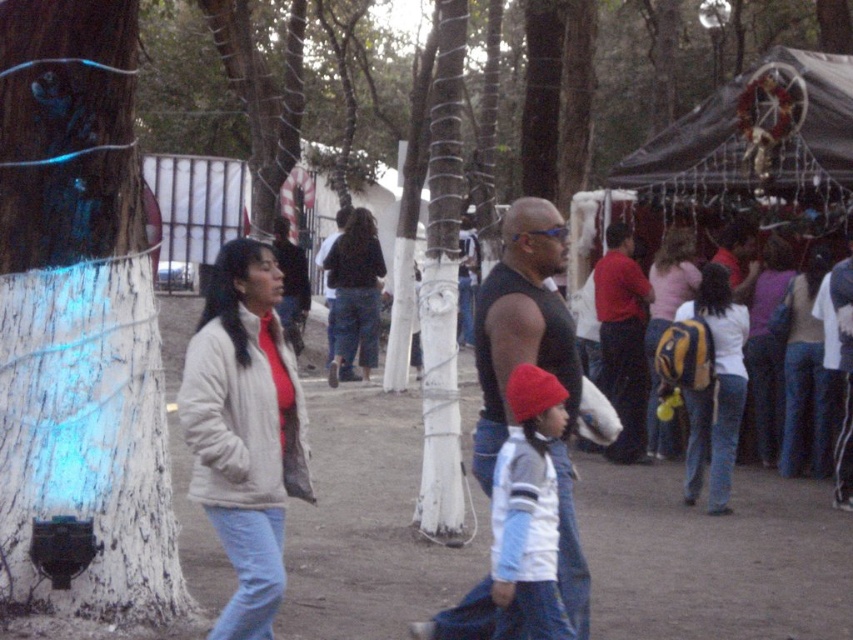
Question: Which object is closer to the camera taking this photo?

Choices:
 (A) black tarpaulin canopy at upper right
 (B) yellow and black backpack at center
 (C) white fleece jacket at center

Answer: (C)

Question: Observing the image, what is the correct spatial positioning of yellow backpack at center right in reference to yellow and black backpack at center?

Choices:
 (A) above
 (B) below

Answer: (B)

Question: Can you confirm if white painted bark at left is thinner than yellow backpack at center-right?

Choices:
 (A) yes
 (B) no

Answer: (B)

Question: Which is nearer to the white fleece jacket at center?

Choices:
 (A) denim jacket at lower right
 (B) black tarpaulin canopy at upper right
 (C) light beige fleece jacket at center
 (D) dark blue jeans at center

Answer: (C)

Question: Which of the following is the closest to the observer?

Choices:
 (A) (358, 252)
 (B) (628, 400)
 (C) (706, 280)

Answer: (C)

Question: Does light beige fleece jacket at center appear under purple fabric purse at center?

Choices:
 (A) no
 (B) yes

Answer: (B)